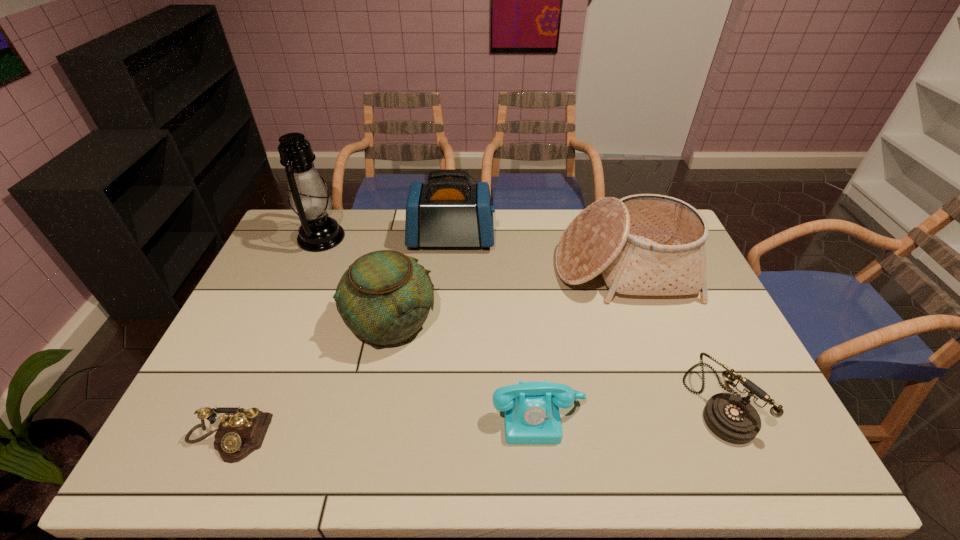
Where is `blank space located on the back of the fourth shortest object`? blank space located on the back of the fourth shortest object is located at coordinates (400, 275).

The height and width of the screenshot is (540, 960). I want to click on vacant region located 0.200m on the left of the rightmost telephone, so click(x=610, y=401).

Where is `oil lamp present at the far edge`? oil lamp present at the far edge is located at coordinates tap(309, 199).

Identify the location of toaster situated at the far edge. (447, 211).

Where is `basket at the far edge`? Image resolution: width=960 pixels, height=540 pixels. basket at the far edge is located at coordinates (646, 244).

Identify the location of oil lamp that is positioned at the left edge. (309, 199).

Where is `telephone that is at the left edge`? This screenshot has height=540, width=960. telephone that is at the left edge is located at coordinates (242, 431).

Image resolution: width=960 pixels, height=540 pixels. In order to click on basket at the right edge in this screenshot , I will do `click(646, 244)`.

The height and width of the screenshot is (540, 960). I want to click on telephone that is at the right edge, so click(732, 418).

Find the location of a particular element. object that is at the far left corner is located at coordinates (309, 199).